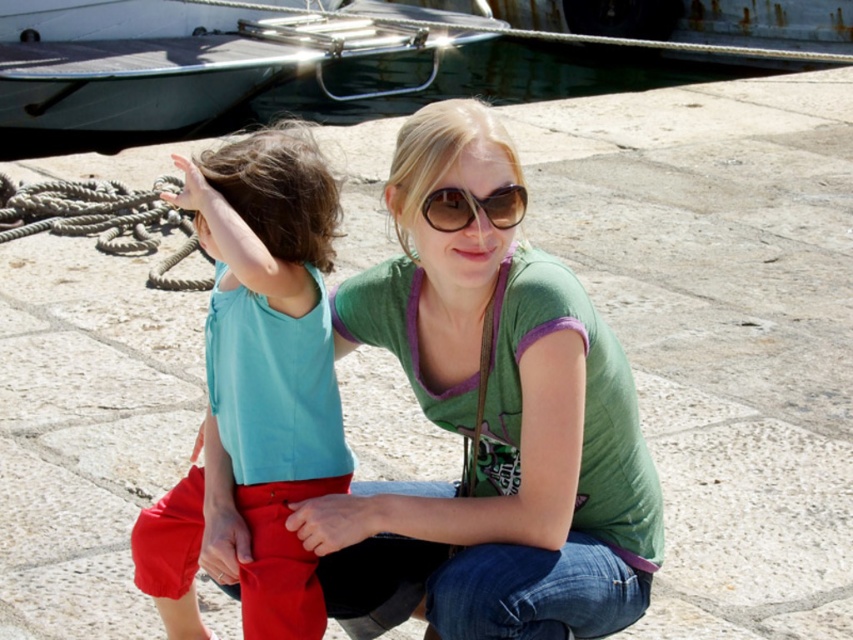
You are a photographer trying to capture a closeup of the green cotton shirt at center and the brown matte sunglasses at center. Which object should you focus on first to ensure both are in focus?

The green cotton shirt at center is closer to the viewer than the brown matte sunglasses at center, so focus on the green cotton shirt at center first to ensure both are in focus.

Consider the image. You are a photographer trying to capture the scene of the two people on the dock. You notice the matte teal tank top at center and the metallic gray boat at upper left. Which object should you focus on first if you want to prioritize the closer subject?

The matte teal tank top at center should be focused on first because it is closer to the photographer than the metallic gray boat at upper left.